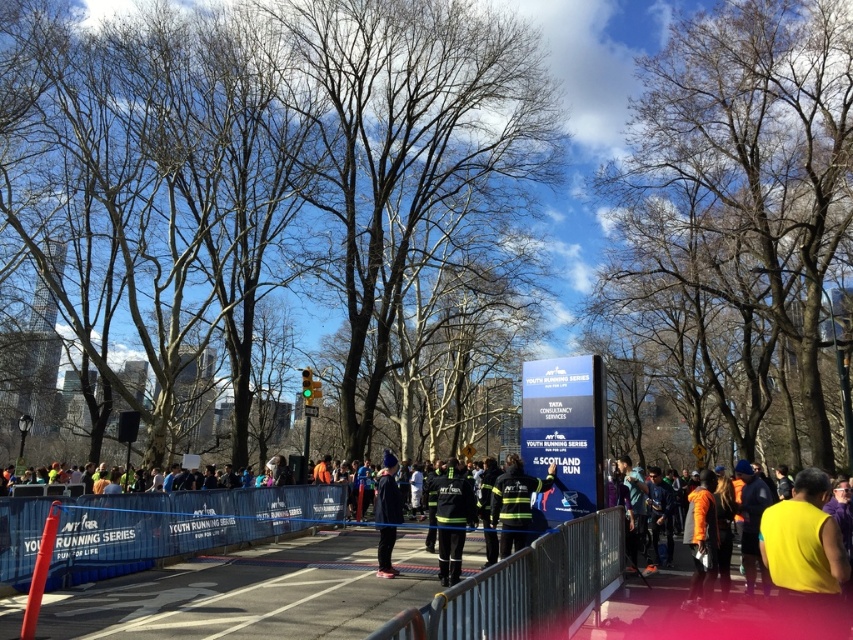
Does bare branches at center have a greater width compared to orange fabric jacket at center?

Yes, bare branches at center is wider than orange fabric jacket at center.

Is bare branches at center to the left of orange fabric jacket at center from the viewer's perspective?

Yes, bare branches at center is to the left of orange fabric jacket at center.

Identify the location of bare branches at center. pos(271,164).

The width and height of the screenshot is (853, 640). Identify the location of bare branches at center. (271, 164).

Does blue fabric barrier at center appear over reflective black jacket at center?

Yes, blue fabric barrier at center is above reflective black jacket at center.

The image size is (853, 640). I want to click on blue fabric barrier at center, so click(x=178, y=525).

Locate an element on the screen. This screenshot has height=640, width=853. blue fabric barrier at center is located at coordinates (178, 525).

Find the location of a particular element. blue fabric barrier at center is located at coordinates (178, 525).

Does bare branches at center have a lesser width compared to matte black uniform at center?

No.

Who is more distant from viewer, [399,275] or [393,467]?

The point [399,275] is behind.

At what (x,y) coordinates should I click in order to perform the action: click on bare branches at center. Please return your answer as a coordinate pair (x, y). Looking at the image, I should click on (271, 164).